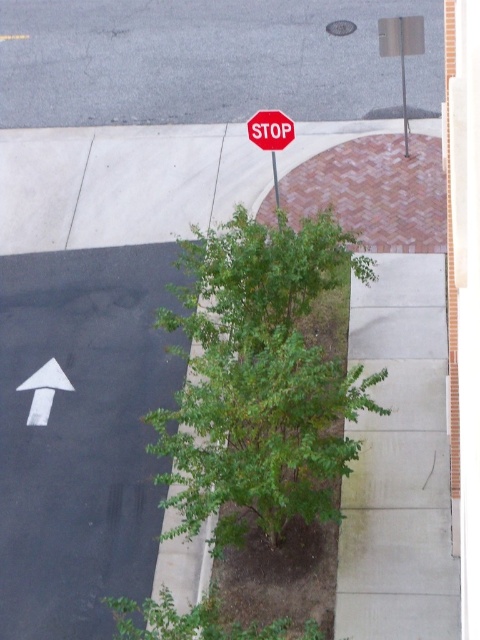
Can you confirm if green leafy tree at center is positioned to the left of metallic pole at center?

In fact, green leafy tree at center is to the right of metallic pole at center.

Is green leafy tree at center positioned behind metallic pole at center?

No, it is in front of metallic pole at center.

Is point (207, 310) closer to viewer compared to point (278, 224)?

That is True.

The width and height of the screenshot is (480, 640). In order to click on green leafy tree at center in this screenshot , I will do `click(260, 376)`.

Which of these two, green leafy tree at center or red matte stop sign at upper center, stands taller?

Standing taller between the two is green leafy tree at center.

Between green leafy tree at center and red matte stop sign at upper center, which one has less height?

red matte stop sign at upper center is shorter.

Is point (326, 221) positioned after point (253, 118)?

No, (326, 221) is closer to viewer.

At what (x,y) coordinates should I click in order to perform the action: click on green leafy tree at center. Please return your answer as a coordinate pair (x, y). The height and width of the screenshot is (640, 480). Looking at the image, I should click on (260, 376).

Which is more to the left, red matte stop sign at upper center or metallic pole at center?

Positioned to the left is metallic pole at center.

Does red matte stop sign at upper center appear on the right side of metallic pole at center?

Yes, red matte stop sign at upper center is to the right of metallic pole at center.

You are a GUI agent. You are given a task and a screenshot of the screen. Output one action in this format:
    pyautogui.click(x=<x>, y=<y>)
    Task: Click on the red matte stop sign at upper center
    Image resolution: width=480 pixels, height=640 pixels.
    Given the screenshot: What is the action you would take?
    pyautogui.click(x=271, y=129)

The height and width of the screenshot is (640, 480). Find the location of `red matte stop sign at upper center`. red matte stop sign at upper center is located at coordinates (271, 129).